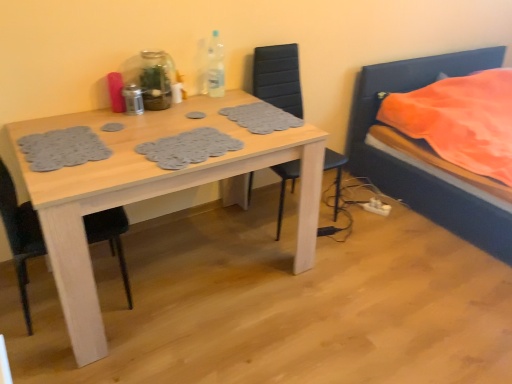
At what (x,y) coordinates should I click in order to perform the action: click on free space above light wood table at center (from a real-world perspective). Please return your answer as a coordinate pair (x, y). Looking at the image, I should click on (168, 130).